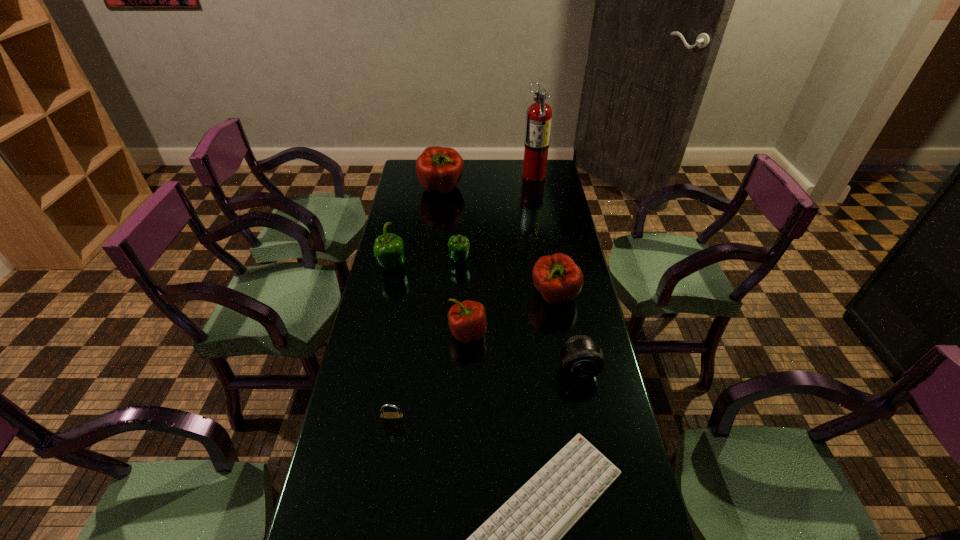
Find the location of a particular element. The image size is (960, 540). the seventh farthest object is located at coordinates (581, 357).

Locate an element on the screen. This screenshot has width=960, height=540. brass padlock is located at coordinates (389, 419).

Where is `the second shortest object`? The width and height of the screenshot is (960, 540). the second shortest object is located at coordinates (389, 419).

Locate an element on the screen. Image resolution: width=960 pixels, height=540 pixels. free space located on the nozzle side of the tallest object is located at coordinates [x=449, y=174].

Where is `vacant space located 0.300m on the nozzle side of the tallest object`? The image size is (960, 540). vacant space located 0.300m on the nozzle side of the tallest object is located at coordinates (460, 174).

Where is `vacant area located on the nozzle side of the tallest object`? vacant area located on the nozzle side of the tallest object is located at coordinates (481, 174).

At what (x,y) coordinates should I click in order to perform the action: click on vacant area located 0.400m on the front of the farthest bell pepper. Please return your answer as a coordinate pair (x, y). Looking at the image, I should click on (433, 260).

At what (x,y) coordinates should I click in order to perform the action: click on vacant area situated 0.340m on the front of the bigger green bell pepper. Please return your answer as a coordinate pair (x, y). The height and width of the screenshot is (540, 960). Looking at the image, I should click on (373, 352).

Where is `blank space located 0.330m on the front of the second biggest pink bell pepper`? Image resolution: width=960 pixels, height=540 pixels. blank space located 0.330m on the front of the second biggest pink bell pepper is located at coordinates (573, 402).

Find the location of `free space located on the right of the smaller green bell pepper`. free space located on the right of the smaller green bell pepper is located at coordinates (510, 260).